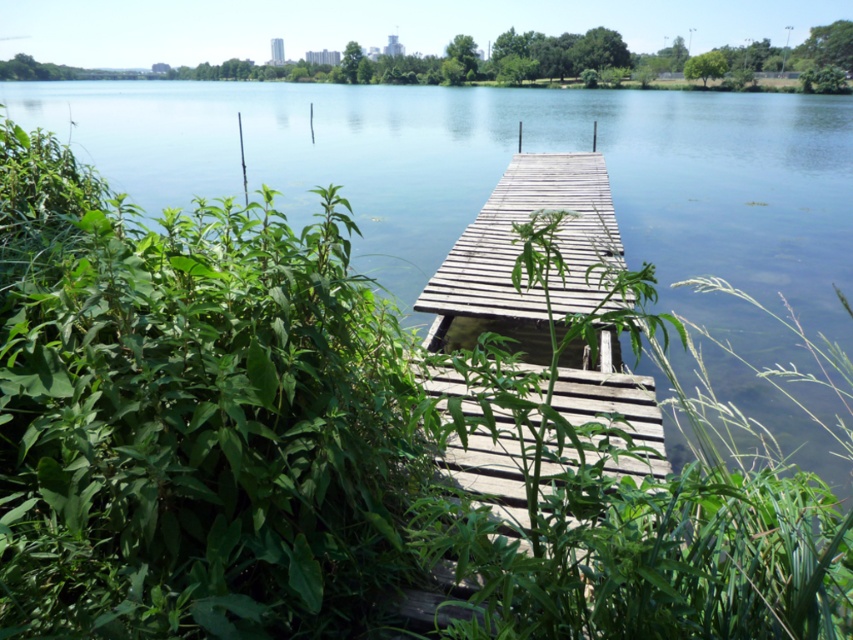
You are standing on the wooden dock and looking towards the green leafy plant at center and the green leafy plants at upper center. Which group of plants appears closer to you?

The green leafy plant at center appears closer to you because it is shorter than the green leafy plants at upper center, which are taller and thus likely positioned further away in the scene.

You are a botanist examining the plants on the lakeside dock. You notice two groups of green leafy plants. One is labeled as the green leafy plant at center and the other as green leafy plants at upper center. Which group appears to be larger in size?

The green leafy plants at upper center are larger in size compared to the green leafy plant at center.

You are standing on the wooden dock and looking towards the lake. There are two points marked on the dock. The first point is at coordinates point [747,470] and the second point is at point [618,22]. Which point is closer to you?

Point [747,470] is closer to the camera than point [618,22].